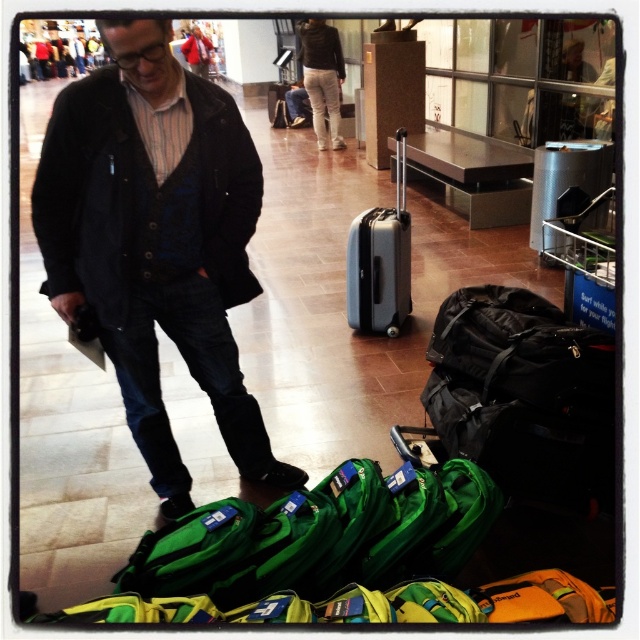
Does dark blue jeans at lower left have a smaller size compared to silver metallic suitcase at center?

No.

Is dark blue jeans at lower left thinner than silver metallic suitcase at center?

No.

The width and height of the screenshot is (640, 640). What do you see at coordinates (157, 243) in the screenshot?
I see `dark blue jeans at lower left` at bounding box center [157, 243].

Where is `dark blue jeans at lower left`? dark blue jeans at lower left is located at coordinates (157, 243).